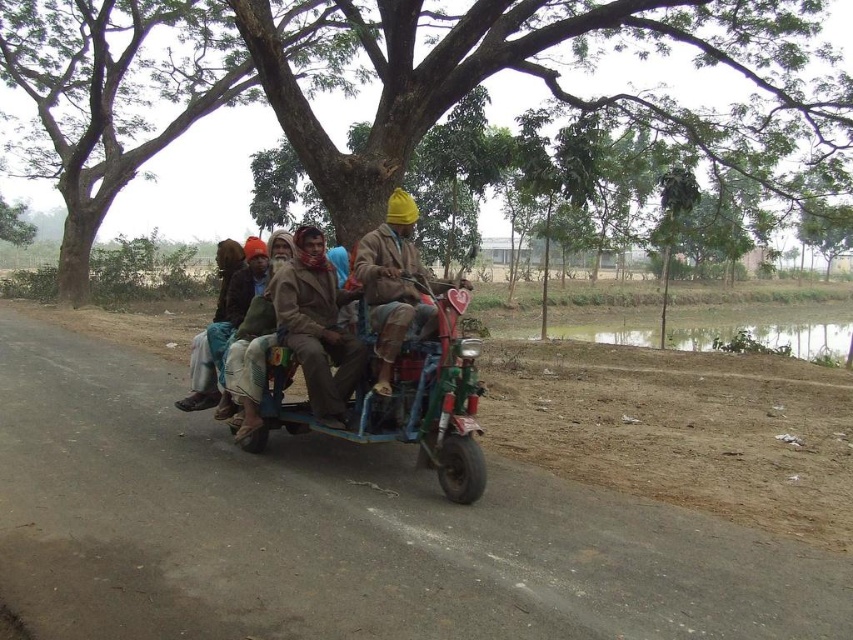
Question: Which of the following is the closest to the observer?

Choices:
 (A) (360, 275)
 (B) (450, 60)

Answer: (A)

Question: Can you confirm if brown fabric jacket at center is thinner than matte brown jacket at center?

Choices:
 (A) yes
 (B) no

Answer: (B)

Question: Which object is the closest to the matte brown jacket at center?

Choices:
 (A) metallic green motorbike at center
 (B) green leafy tree at center
 (C) brown fabric jacket at center

Answer: (C)

Question: From the image, what is the correct spatial relationship of metallic green motorbike at center in relation to matte brown jacket at center?

Choices:
 (A) below
 (B) above

Answer: (A)

Question: Does brown fabric jacket at center lie behind matte brown jacket at center?

Choices:
 (A) yes
 (B) no

Answer: (A)

Question: Among these objects, which one is farthest from the camera?

Choices:
 (A) green leafy tree at center
 (B) matte brown jacket at center
 (C) metallic green motorbike at center
 (D) brown fabric jacket at center

Answer: (A)